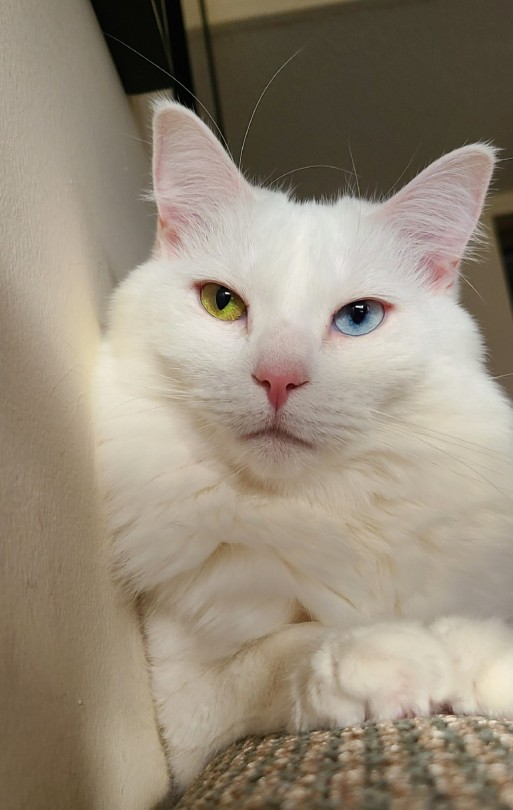
Where is `wall`? wall is located at coordinates (40, 368).